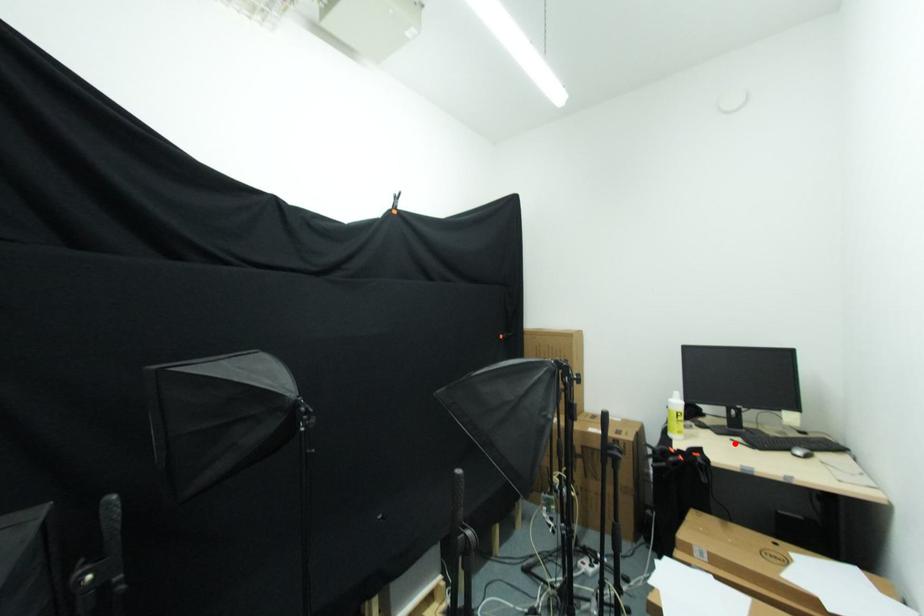
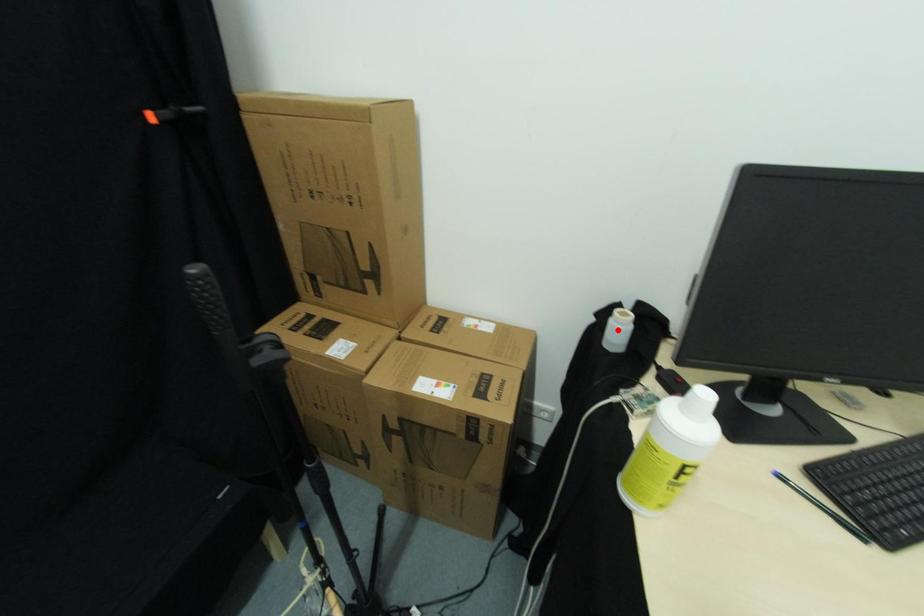
I am providing you with two images of the same scene from different viewpoints. A red point is marked on the first image and another point is marked on the second image. Is the red point in image1 aligned with the point shown in image2?

No